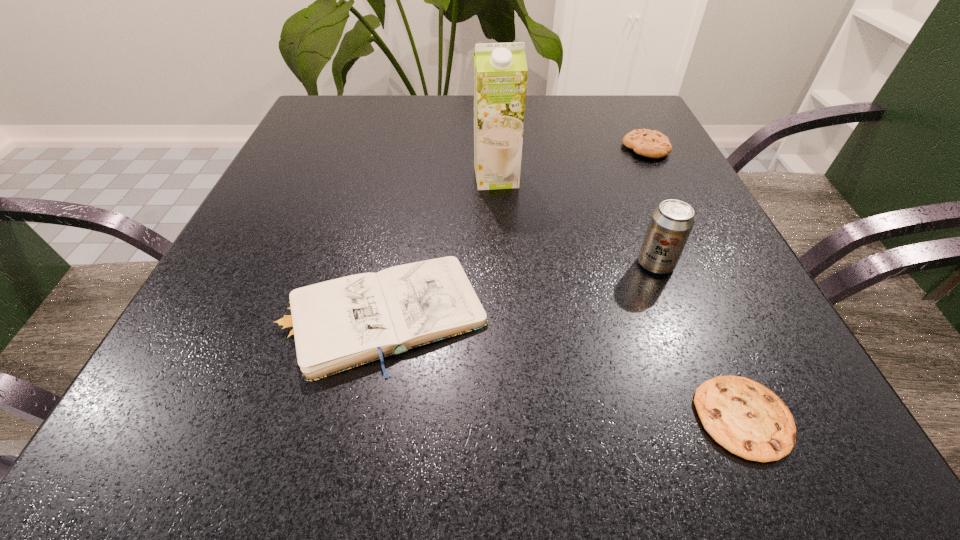
The width and height of the screenshot is (960, 540). In order to click on blank region between the shorter cookie and the notebook in this screenshot , I will do `click(561, 366)`.

What are the coordinates of `free space between the second tallest object and the fourth nearest object` in the screenshot? It's located at (576, 221).

Where is `free space between the shorter cookie and the beer can`? The width and height of the screenshot is (960, 540). free space between the shorter cookie and the beer can is located at coordinates 700,341.

The width and height of the screenshot is (960, 540). Find the location of `object that stands as the closest to the farther cookie`. object that stands as the closest to the farther cookie is located at coordinates (500, 70).

Choose which object is the third nearest neighbor to the farthest object. Please provide its 2D coordinates. Your answer should be formatted as a tuple, i.e. [(x, y)], where the tuple contains the x and y coordinates of a point satisfying the conditions above.

[(336, 325)]

You are a GUI agent. You are given a task and a screenshot of the screen. Output one action in this format:
    pyautogui.click(x=<x>, y=<y>)
    Task: Click on the free location that satisfies the following two spatial constraints: 1. on the back side of the tallest object; 2. on the right side of the taller cookie
    The height and width of the screenshot is (540, 960).
    Given the screenshot: What is the action you would take?
    tap(494, 148)